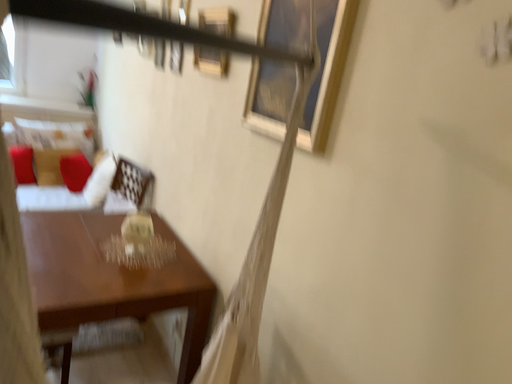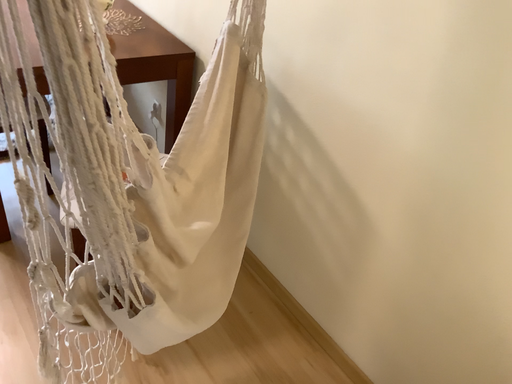
Question: How did the camera likely rotate when shooting the video?

Choices:
 (A) rotated downward
 (B) rotated upward

Answer: (A)